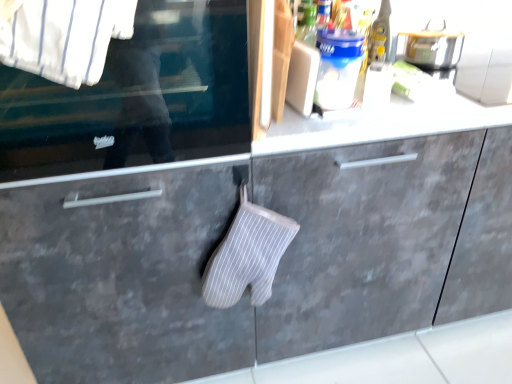
Question: From their relative heights in the image, would you say white striped fabric at upper left is taller or shorter than gray matte drawer at lower left?

Choices:
 (A) short
 (B) tall

Answer: (A)

Question: From the image's perspective, is white striped fabric at upper left positioned above or below gray matte drawer at lower left?

Choices:
 (A) above
 (B) below

Answer: (A)

Question: Estimate the real-world distances between objects in this image. Which object is closer to the white fabric oven mitt at center?

Choices:
 (A) transparent glass window at center
 (B) gray matte drawer at lower left
 (C) white striped fabric oven mitt at center
 (D) metallic silver toaster at upper right
 (E) white striped fabric at upper left

Answer: (C)

Question: Estimate the real-world distances between objects in this image. Which object is closer to the gray matte drawer at lower left?

Choices:
 (A) white striped fabric at upper left
 (B) metallic silver toaster at upper right
 (C) white striped fabric oven mitt at center
 (D) white fabric oven mitt at center
 (E) transparent glass window at center

Answer: (C)